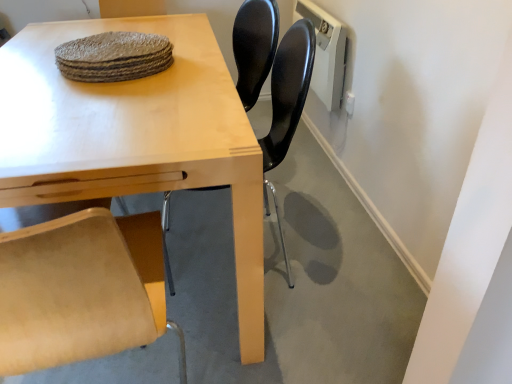
The width and height of the screenshot is (512, 384). I want to click on vacant area located to the right-hand side of rough woven placemat at upper center, so click(x=201, y=70).